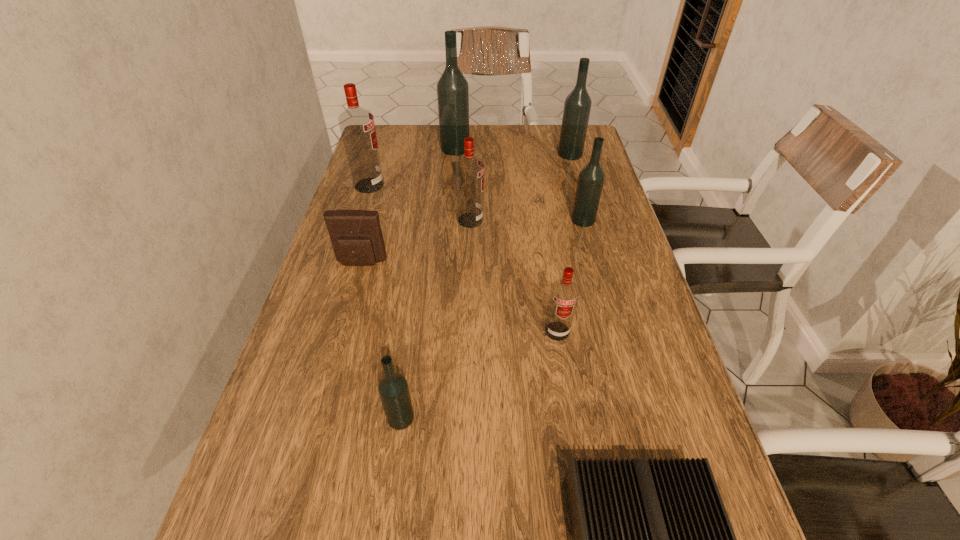
Image resolution: width=960 pixels, height=540 pixels. I want to click on the nearest vodka, so click(393, 388).

At what (x,y) coordinates should I click in order to perform the action: click on the smallest black vodka. Please return your answer as a coordinate pair (x, y). Looking at the image, I should click on (393, 388).

The height and width of the screenshot is (540, 960). Identify the location of the fourth nearest object. (356, 236).

Locate an element on the screen. pouch is located at coordinates (356, 236).

Find the location of a particular element. This screenshot has height=540, width=960. vacant point located 0.390m on the front of the tallest vodka is located at coordinates (448, 231).

Where is `free point located on the front label of the seventh nearest object`? This screenshot has height=540, width=960. free point located on the front label of the seventh nearest object is located at coordinates pyautogui.click(x=465, y=185).

The image size is (960, 540). I want to click on vacant point located on the front of the second biggest black vodka, so click(x=592, y=233).

I want to click on vacant space located on the front label of the second biggest red vodka, so click(532, 220).

Where is `vacant space situated on the back of the second smallest black vodka`? The height and width of the screenshot is (540, 960). vacant space situated on the back of the second smallest black vodka is located at coordinates (567, 162).

Locate an element on the screen. free location located 0.140m on the front label of the sixth farthest vodka is located at coordinates (568, 403).